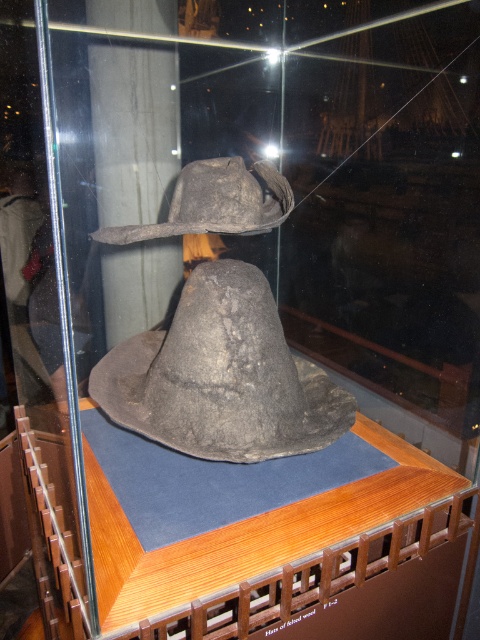
What do you see at coordinates (222, 376) in the screenshot? I see `dark gray felt hat at center` at bounding box center [222, 376].

Can you confirm if dark gray felt hat at center is positioned to the left of dark gray felt hat at upper center?

No, dark gray felt hat at center is not to the left of dark gray felt hat at upper center.

Locate an element on the screen. dark gray felt hat at center is located at coordinates (222, 376).